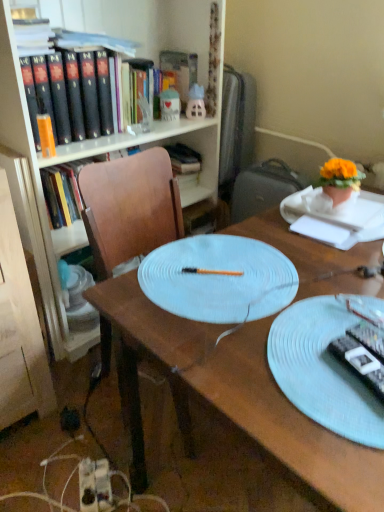
At what (x,y) coordinates should I click in order to perform the action: click on empty space that is ontop of light blue textured plate at center (from a real-world perspective). Please return your answer as a coordinate pair (x, y). Looking at the image, I should click on (332, 349).